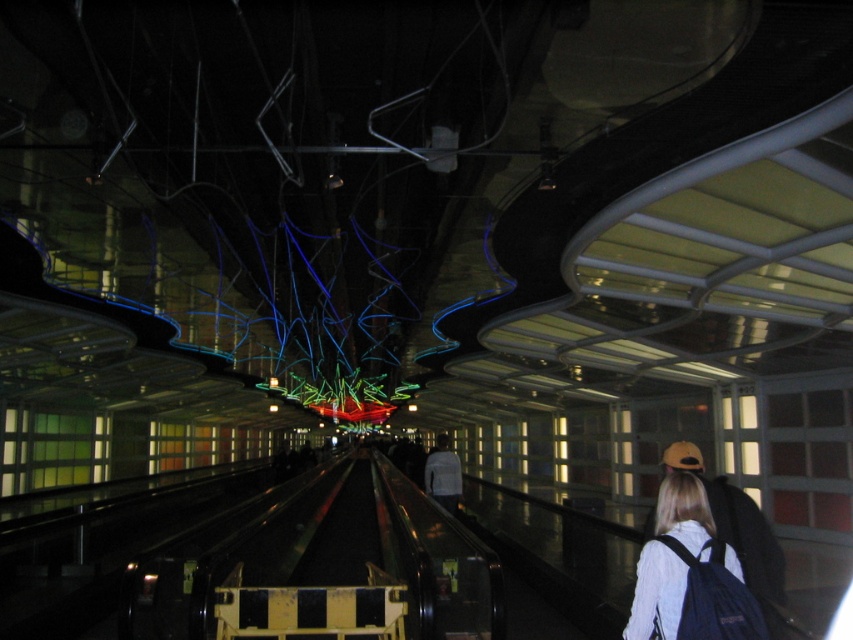
Question: Can you confirm if blue backpack at lower right is positioned below white matte shirt at center?

Choices:
 (A) yes
 (B) no

Answer: (B)

Question: Which point is closer to the camera?

Choices:
 (A) blue backpack at lower right
 (B) white matte shirt at center

Answer: (A)

Question: Which object is closer to the camera taking this photo?

Choices:
 (A) white matte shirt at center
 (B) blue backpack at lower right

Answer: (B)

Question: Is blue backpack at lower right below white matte shirt at center?

Choices:
 (A) no
 (B) yes

Answer: (A)

Question: Considering the relative positions of blue backpack at lower right and white matte shirt at center in the image provided, where is blue backpack at lower right located with respect to white matte shirt at center?

Choices:
 (A) right
 (B) left

Answer: (A)